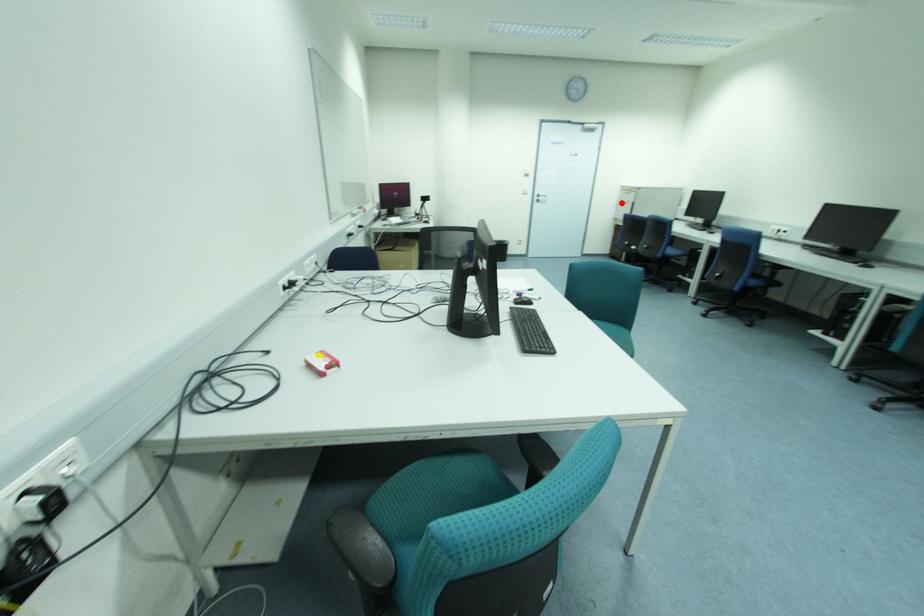
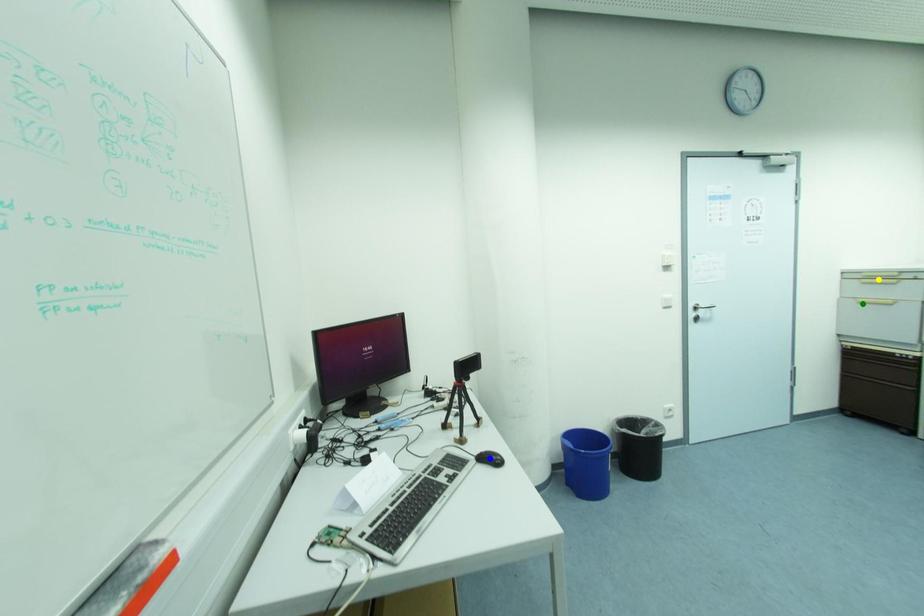
Question: I am providing you with two images of the same scene from different viewpoints. A red point is marked on the first image. You are given multiple points on the second image. Which point in image 2 represents the same 3d spot as the red point in image 1?

Choices:
 (A) yellow point
 (B) green point
 (C) blue point

Answer: (B)